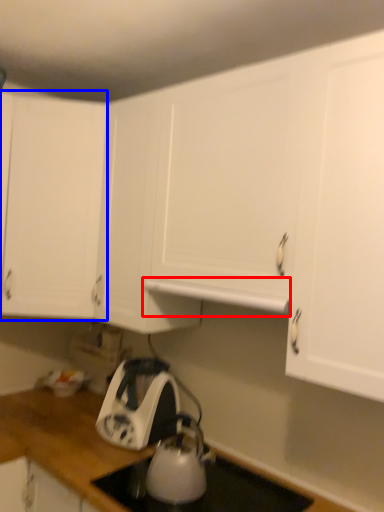
Question: Which of the following is the closest to the observer, exhaust hood (highlighted by a red box) or cabinetry (highlighted by a blue box)?

Choices:
 (A) exhaust hood
 (B) cabinetry

Answer: (A)